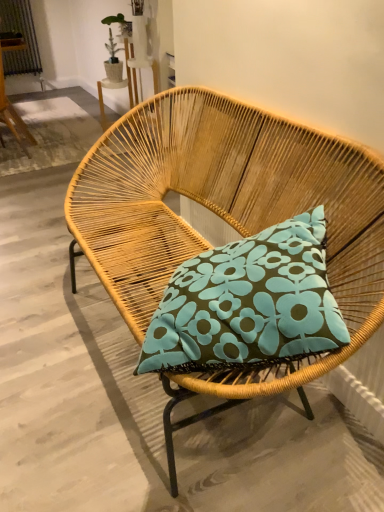
Question: Is woven wood chair at center, positioned as the second chair in left-to-right order, inside the boundaries of rattan chair at upper left, arranged as the second chair when viewed from the right, or outside?

Choices:
 (A) outside
 (B) inside

Answer: (A)

Question: Considering the positions of woven wood chair at center, which ranks as the second chair in top-to-bottom order, and rattan chair at upper left, which ranks as the 1th chair in back-to-front order, in the image, is woven wood chair at center, which ranks as the second chair in top-to-bottom order, bigger or smaller than rattan chair at upper left, which ranks as the 1th chair in back-to-front order,?

Choices:
 (A) big
 (B) small

Answer: (A)

Question: Considering the positions of woven wood chair at center, which is the 1th chair in right-to-left order, and rattan chair at upper left, acting as the first chair starting from the left, in the image, is woven wood chair at center, which is the 1th chair in right-to-left order, wider or thinner than rattan chair at upper left, acting as the first chair starting from the left,?

Choices:
 (A) thin
 (B) wide

Answer: (B)

Question: Is point (9, 103) closer or farther from the camera than point (170, 148)?

Choices:
 (A) farther
 (B) closer

Answer: (A)

Question: In the image, is rattan chair at upper left, which ranks as the second chair in front-to-back order, on the left side or the right side of woven wood chair at center, placed as the 1th chair when sorted from bottom to top?

Choices:
 (A) left
 (B) right

Answer: (A)

Question: From a real-world perspective, is rattan chair at upper left, marked as the first chair in a top-to-bottom arrangement, positioned above or below woven wood chair at center, which ranks as the second chair in top-to-bottom order?

Choices:
 (A) above
 (B) below

Answer: (A)

Question: Is rattan chair at upper left, which ranks as the 1th chair in back-to-front order, taller or shorter than woven wood chair at center, which is the 1th chair in right-to-left order?

Choices:
 (A) short
 (B) tall

Answer: (B)